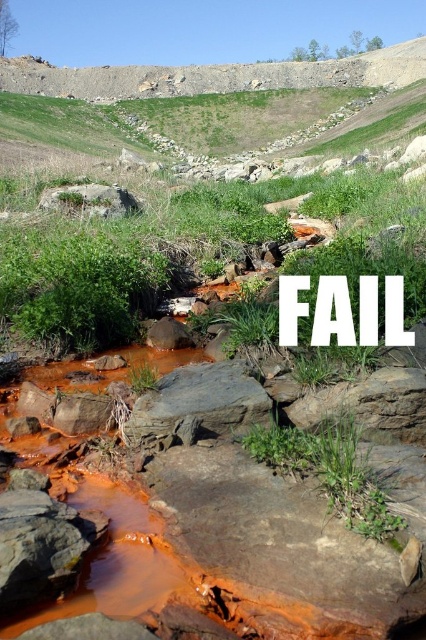
From the picture: Can you confirm if rusty rock cliff at upper center is shorter than rusty rock at center?

No, rusty rock cliff at upper center is not shorter than rusty rock at center.

Is rusty rock cliff at upper center above rusty rock at center?

Yes, rusty rock cliff at upper center is above rusty rock at center.

Who is more distant from viewer, (259,72) or (51,196)?

The point (259,72) is more distant.

Find the location of `rusty rock cliff at upper center`. rusty rock cliff at upper center is located at coordinates (215, 76).